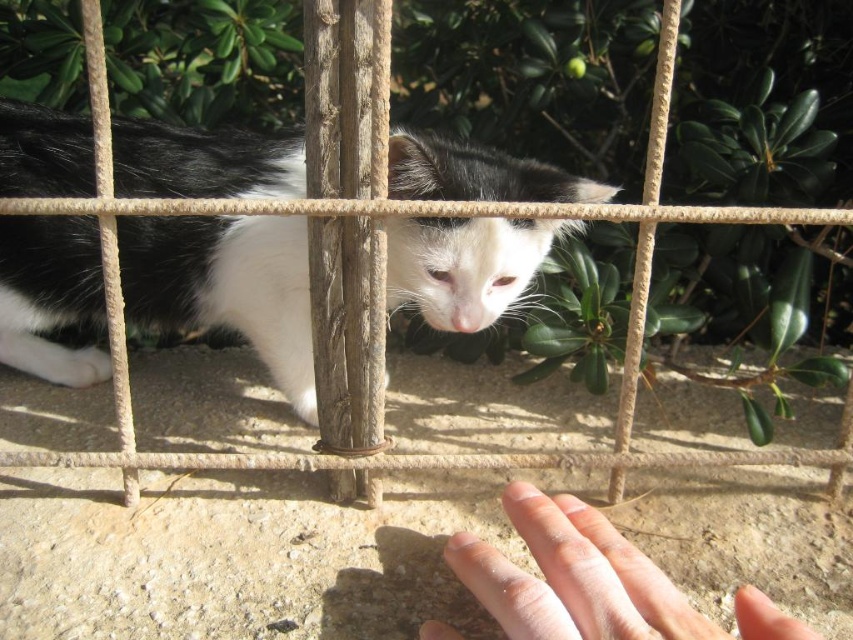
Question: Which point is farther to the camera?

Choices:
 (A) black and white fur cat at center
 (B) pale skin at lower center

Answer: (A)

Question: Is black and white fur cat at center further to camera compared to pale skin at lower center?

Choices:
 (A) yes
 (B) no

Answer: (A)

Question: Can you confirm if black and white fur cat at center is smaller than pale skin at lower center?

Choices:
 (A) no
 (B) yes

Answer: (A)

Question: Which point is farther to the camera?

Choices:
 (A) black and white fur cat at center
 (B) pale skin at lower center

Answer: (A)

Question: In this image, where is black and white fur cat at center located relative to pale skin at lower center?

Choices:
 (A) left
 (B) right

Answer: (A)